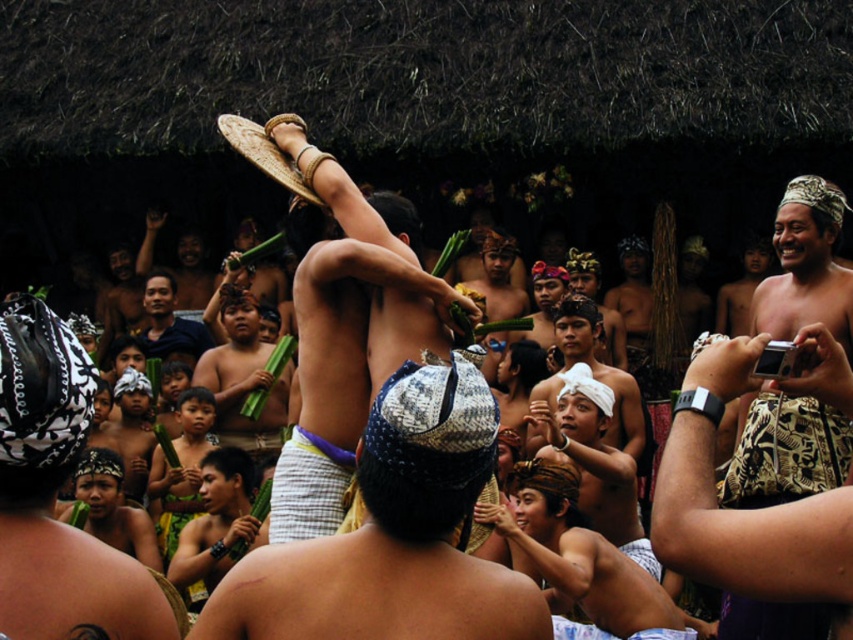
You are an anthropologist observing the scene and need to document the white woven cloth at lower center and the white woven cloth at center. Which one has a greater height?

The white woven cloth at center is taller than the white woven cloth at lower center.

You are observing a traditional ceremony and notice two items at the center of the scene. The blue woven cloth at center and the black printed headscarf at center. Which one is positioned to the right of the other?

The blue woven cloth at center is to the right of the black printed headscarf at center.

Based on the scene description, where is the white woven cloth at lower center located in terms of its 2D coordinates?

The white woven cloth at lower center is located at the 2D coordinates of point (x=579, y=561).